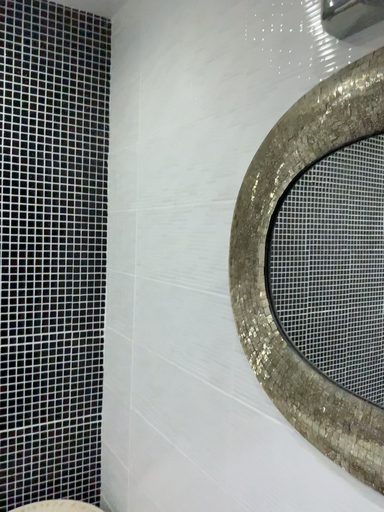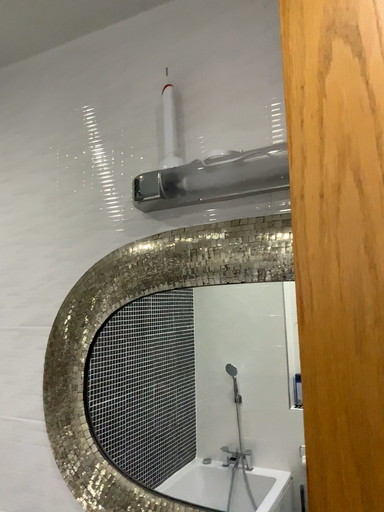
Question: How did the camera likely rotate when shooting the video?

Choices:
 (A) rotated upward
 (B) rotated downward

Answer: (A)